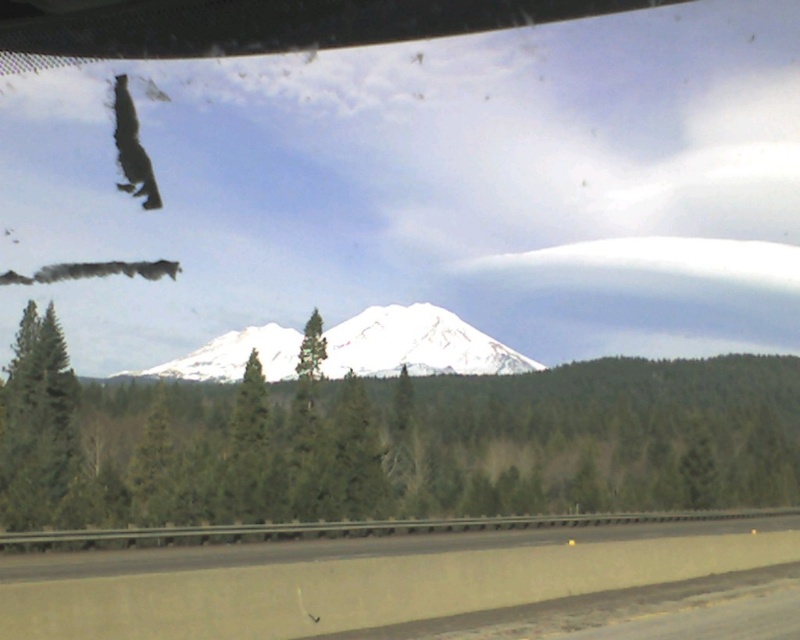
Question: Among these points, which one is farthest from the camera?

Choices:
 (A) (496, 346)
 (B) (42, 468)

Answer: (A)

Question: Which of the following is the closest to the observer?

Choices:
 (A) (646, 371)
 (B) (52, 380)
 (C) (452, 364)

Answer: (B)

Question: From the image, what is the correct spatial relationship of white snow-covered mountain at center in relation to green matte tree at left?

Choices:
 (A) below
 (B) above

Answer: (B)

Question: Is green matte tree at center smaller than green matte tree at left?

Choices:
 (A) yes
 (B) no

Answer: (B)

Question: Can you confirm if white snow-covered mountain at center is positioned to the right of green matte tree at left?

Choices:
 (A) yes
 (B) no

Answer: (A)

Question: Which of the following is the farthest from the observer?

Choices:
 (A) green matte tree at center
 (B) green matte tree at left
 (C) white snow-covered mountain at center

Answer: (C)